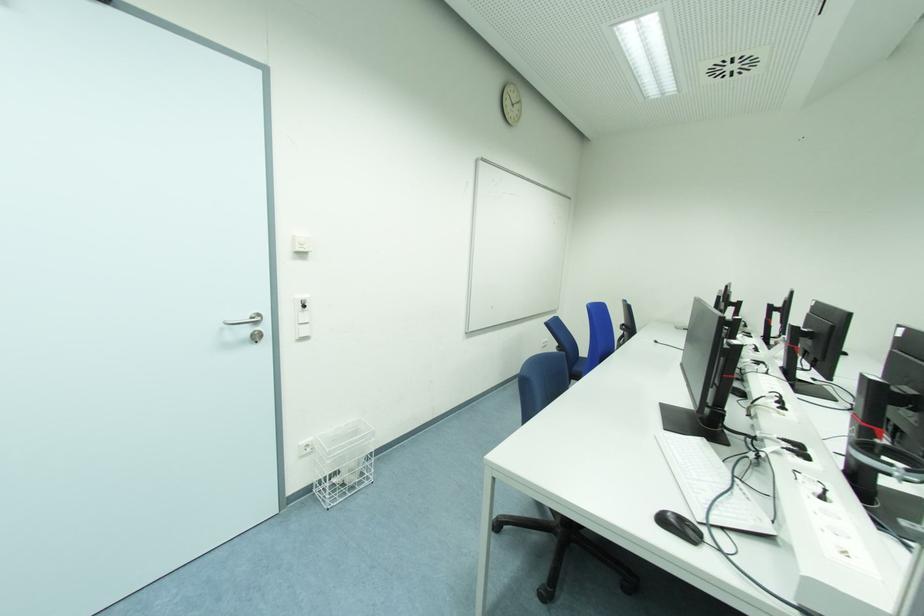
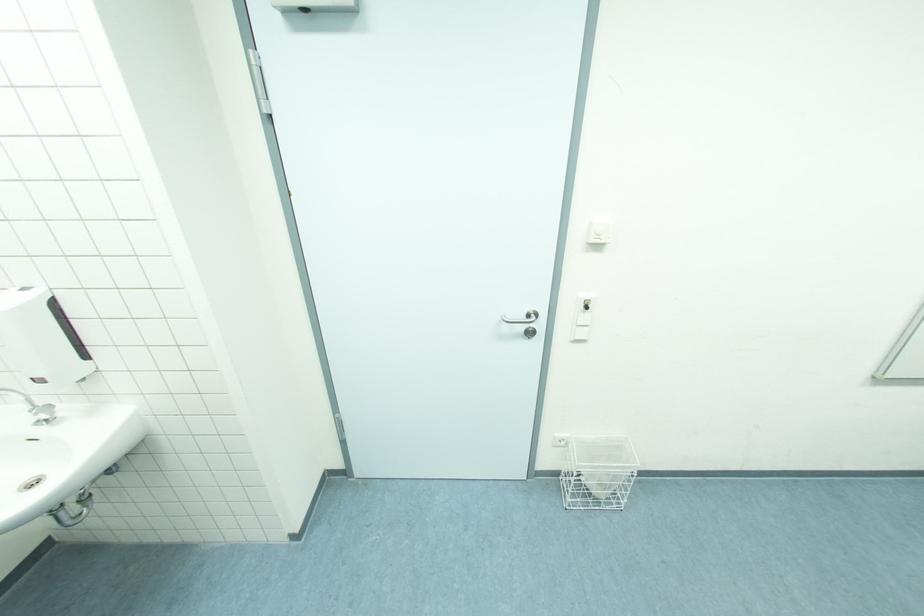
Find the pixel in the second image that matches point (260, 339) in the first image.

(532, 334)